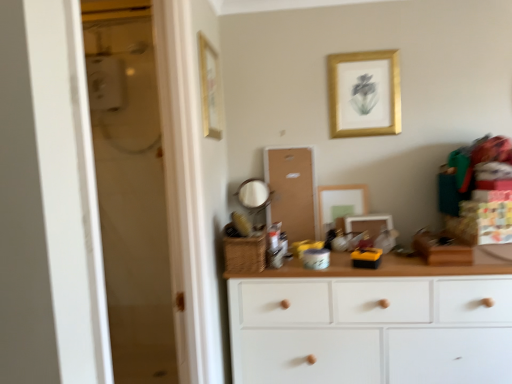
What do you see at coordinates (364, 94) in the screenshot? The width and height of the screenshot is (512, 384). I see `gold/golden frame at upper center, which is the second picture frame in right-to-left order` at bounding box center [364, 94].

The height and width of the screenshot is (384, 512). What do you see at coordinates (210, 89) in the screenshot? I see `wooden picture frame at upper center, marked as the 1th picture frame in a left-to-right arrangement` at bounding box center [210, 89].

The image size is (512, 384). What are the coordinates of `matte white picture frame at center, positioned as the fourth picture frame in left-to-right order` in the screenshot? It's located at (369, 224).

From the picture: Would you say gold/golden frame at upper center, which is the second picture frame in right-to-left order, contains white wood chest of drawers at center?

No, white wood chest of drawers at center is not surrounded by gold/golden frame at upper center, which is the second picture frame in right-to-left order.

Is gold/golden frame at upper center, arranged as the third picture frame when viewed from the left, turned away from white wood chest of drawers at center?

gold/golden frame at upper center, arranged as the third picture frame when viewed from the left, does not have its back to white wood chest of drawers at center.

From the image's perspective, which is above, gold/golden frame at upper center, which is the second picture frame in right-to-left order, or white wood chest of drawers at center?

gold/golden frame at upper center, which is the second picture frame in right-to-left order, is shown above in the image.

What's the angular difference between gold/golden frame at upper center, which is the second picture frame in right-to-left order, and white wood chest of drawers at center's facing directions?

1.18 degrees.

Which is less distant, (357, 88) or (387, 228)?

Point (357, 88) is positioned farther from the camera compared to point (387, 228).

From the gold/golden frame at upper center, which is the second picture frame in right-to-left order, count 1st picture frames forward and point to it. Please provide its 2D coordinates.

[(369, 224)]

Considering the sizes of objects gold/golden frame at upper center, which is the second picture frame in right-to-left order, and matte white picture frame at center, positioned as the first picture frame in right-to-left order, in the image provided, who is taller, gold/golden frame at upper center, which is the second picture frame in right-to-left order, or matte white picture frame at center, positioned as the first picture frame in right-to-left order,?

gold/golden frame at upper center, which is the second picture frame in right-to-left order, is taller.

From a real-world perspective, is gold/golden frame at upper center, arranged as the third picture frame when viewed from the left, positioned over matte white picture frame at center, positioned as the first picture frame in right-to-left order, based on gravity?

Yes, from a real-world perspective, gold/golden frame at upper center, arranged as the third picture frame when viewed from the left, is above matte white picture frame at center, positioned as the first picture frame in right-to-left order.

Is white wood chest of drawers at center at the right side of matte gold picture frame at center, the 2th picture frame when ordered from left to right?

Correct, you'll find white wood chest of drawers at center to the right of matte gold picture frame at center, the 2th picture frame when ordered from left to right.

Can we say white wood chest of drawers at center lies outside matte gold picture frame at center, the 2th picture frame when ordered from left to right?

Yes, white wood chest of drawers at center is outside of matte gold picture frame at center, the 2th picture frame when ordered from left to right.

Considering the relative sizes of white wood chest of drawers at center and matte gold picture frame at center, which appears as the 3th picture frame when viewed from the right, in the image provided, is white wood chest of drawers at center smaller than matte gold picture frame at center, which appears as the 3th picture frame when viewed from the right,?

Incorrect, white wood chest of drawers at center is not smaller in size than matte gold picture frame at center, which appears as the 3th picture frame when viewed from the right.

In the scene shown: Which is closer to the camera, (346, 203) or (351, 276)?

The point (351, 276) is closer.

Who is shorter, matte gold picture frame at center, the 2th picture frame when ordered from left to right, or white wood chest of drawers at center?

With less height is matte gold picture frame at center, the 2th picture frame when ordered from left to right.

Is matte gold picture frame at center, which appears as the 3th picture frame when viewed from the right, not within white wood chest of drawers at center?

matte gold picture frame at center, which appears as the 3th picture frame when viewed from the right, lies outside white wood chest of drawers at center's area.

From a real-world perspective, is matte gold picture frame at center, the 2th picture frame when ordered from left to right, positioned above or below white wood chest of drawers at center?

matte gold picture frame at center, the 2th picture frame when ordered from left to right, is above white wood chest of drawers at center.

From the picture: Considering the relative positions of matte white picture frame at center, positioned as the first picture frame in right-to-left order, and corkboard at center in the image provided, is matte white picture frame at center, positioned as the first picture frame in right-to-left order, behind corkboard at center?

That is False.

Is matte white picture frame at center, positioned as the first picture frame in right-to-left order, bigger or smaller than corkboard at center?

Clearly, matte white picture frame at center, positioned as the first picture frame in right-to-left order, is smaller in size than corkboard at center.

Does point (372, 216) come closer to viewer compared to point (284, 229)?

That is False.

From a real-world perspective, which object stands above the other?

corkboard at center, from a real-world perspective.

From a real-world perspective, is matte white picture frame at center, positioned as the first picture frame in right-to-left order, above or below gold/golden frame at upper center, which is the second picture frame in right-to-left order?

Clearly, from a real-world perspective, matte white picture frame at center, positioned as the first picture frame in right-to-left order, is below gold/golden frame at upper center, which is the second picture frame in right-to-left order.

Is matte white picture frame at center, positioned as the fourth picture frame in left-to-right order, oriented towards gold/golden frame at upper center, which is the second picture frame in right-to-left order?

No.

Considering the sizes of matte white picture frame at center, positioned as the fourth picture frame in left-to-right order, and gold/golden frame at upper center, arranged as the third picture frame when viewed from the left, in the image, is matte white picture frame at center, positioned as the fourth picture frame in left-to-right order, taller or shorter than gold/golden frame at upper center, arranged as the third picture frame when viewed from the left,?

Clearly, matte white picture frame at center, positioned as the fourth picture frame in left-to-right order, is shorter compared to gold/golden frame at upper center, arranged as the third picture frame when viewed from the left.

Between matte gold picture frame at center, which appears as the 3th picture frame when viewed from the right, and gold/golden frame at upper center, which is the second picture frame in right-to-left order, which one appears on the left side from the viewer's perspective?

From the viewer's perspective, matte gold picture frame at center, which appears as the 3th picture frame when viewed from the right, appears more on the left side.

Is matte gold picture frame at center, which appears as the 3th picture frame when viewed from the right, shorter than gold/golden frame at upper center, arranged as the third picture frame when viewed from the left?

Yes.

Between matte gold picture frame at center, the 2th picture frame when ordered from left to right, and gold/golden frame at upper center, arranged as the third picture frame when viewed from the left, which one has smaller size?

gold/golden frame at upper center, arranged as the third picture frame when viewed from the left, is smaller.

Is matte gold picture frame at center, which appears as the 3th picture frame when viewed from the right, surrounding gold/golden frame at upper center, arranged as the third picture frame when viewed from the left?

No, gold/golden frame at upper center, arranged as the third picture frame when viewed from the left, is not a part of matte gold picture frame at center, which appears as the 3th picture frame when viewed from the right.

This screenshot has height=384, width=512. In order to click on chest of drawers on the right of gold/golden frame at upper center, arranged as the third picture frame when viewed from the left in this screenshot , I will do `click(373, 323)`.

Locate an element on the screen. The image size is (512, 384). picture frame that is the 1st one when counting forward from the gold/golden frame at upper center, which is the second picture frame in right-to-left order is located at coordinates (369, 224).

Looking at this image, estimate the real-world distances between objects in this image. Which object is closer to wooden picture frame at upper center, which appears as the fourth picture frame when viewed from the right, matte gold picture frame at center, which appears as the 3th picture frame when viewed from the right, or gold/golden frame at upper center, arranged as the third picture frame when viewed from the left?

gold/golden frame at upper center, arranged as the third picture frame when viewed from the left, is positioned closer to the anchor wooden picture frame at upper center, which appears as the fourth picture frame when viewed from the right.

From the image, which object appears to be farther from corkboard at center, white wood chest of drawers at center or gold/golden frame at upper center, arranged as the third picture frame when viewed from the left?

white wood chest of drawers at center is further to corkboard at center.

Estimate the real-world distances between objects in this image. Which object is further from matte white picture frame at center, positioned as the first picture frame in right-to-left order, corkboard at center or matte gold picture frame at center, the 2th picture frame when ordered from left to right?

The object further to matte white picture frame at center, positioned as the first picture frame in right-to-left order, is corkboard at center.

From the picture: Based on their spatial positions, is matte white picture frame at center, positioned as the first picture frame in right-to-left order, or corkboard at center closer to gold/golden frame at upper center, which is the second picture frame in right-to-left order?

Among the two, corkboard at center is located nearer to gold/golden frame at upper center, which is the second picture frame in right-to-left order.

When comparing their distances from wooden picture frame at upper center, marked as the 1th picture frame in a left-to-right arrangement, does gold/golden frame at upper center, arranged as the third picture frame when viewed from the left, or white wood chest of drawers at center seem closer?

Among the two, gold/golden frame at upper center, arranged as the third picture frame when viewed from the left, is located nearer to wooden picture frame at upper center, marked as the 1th picture frame in a left-to-right arrangement.

Which object lies further to the anchor point gold/golden frame at upper center, which is the second picture frame in right-to-left order, matte white picture frame at center, positioned as the first picture frame in right-to-left order, or matte gold picture frame at center, the 2th picture frame when ordered from left to right?

matte white picture frame at center, positioned as the first picture frame in right-to-left order, lies further to gold/golden frame at upper center, which is the second picture frame in right-to-left order, than the other object.

Considering their positions, is wooden picture frame at upper center, which appears as the fourth picture frame when viewed from the right, positioned closer to corkboard at center than gold/golden frame at upper center, which is the second picture frame in right-to-left order?

gold/golden frame at upper center, which is the second picture frame in right-to-left order, is closer to corkboard at center.

Which object lies further to the anchor point matte white picture frame at center, positioned as the fourth picture frame in left-to-right order, gold/golden frame at upper center, which is the second picture frame in right-to-left order, or corkboard at center?

Based on the image, gold/golden frame at upper center, which is the second picture frame in right-to-left order, appears to be further to matte white picture frame at center, positioned as the fourth picture frame in left-to-right order.

Where is `picture frame located between wooden picture frame at upper center, which appears as the fourth picture frame when viewed from the right, and gold/golden frame at upper center, arranged as the third picture frame when viewed from the left, in the left-right direction`? The width and height of the screenshot is (512, 384). picture frame located between wooden picture frame at upper center, which appears as the fourth picture frame when viewed from the right, and gold/golden frame at upper center, arranged as the third picture frame when viewed from the left, in the left-right direction is located at coordinates (340, 203).

Identify the location of screen door situated between wooden picture frame at upper center, which appears as the fourth picture frame when viewed from the right, and gold/golden frame at upper center, arranged as the third picture frame when viewed from the left, from left to right. (291, 191).

You are a GUI agent. You are given a task and a screenshot of the screen. Output one action in this format:
    pyautogui.click(x=<x>, y=<y>)
    Task: Click on the screen door between wooden picture frame at upper center, which appears as the fourth picture frame when viewed from the right, and matte gold picture frame at center, the 2th picture frame when ordered from left to right
    
    Given the screenshot: What is the action you would take?
    pyautogui.click(x=291, y=191)

Where is `screen door between gold/golden frame at upper center, which is the second picture frame in right-to-left order, and matte gold picture frame at center, the 2th picture frame when ordered from left to right, in the vertical direction`? screen door between gold/golden frame at upper center, which is the second picture frame in right-to-left order, and matte gold picture frame at center, the 2th picture frame when ordered from left to right, in the vertical direction is located at coordinates (291, 191).